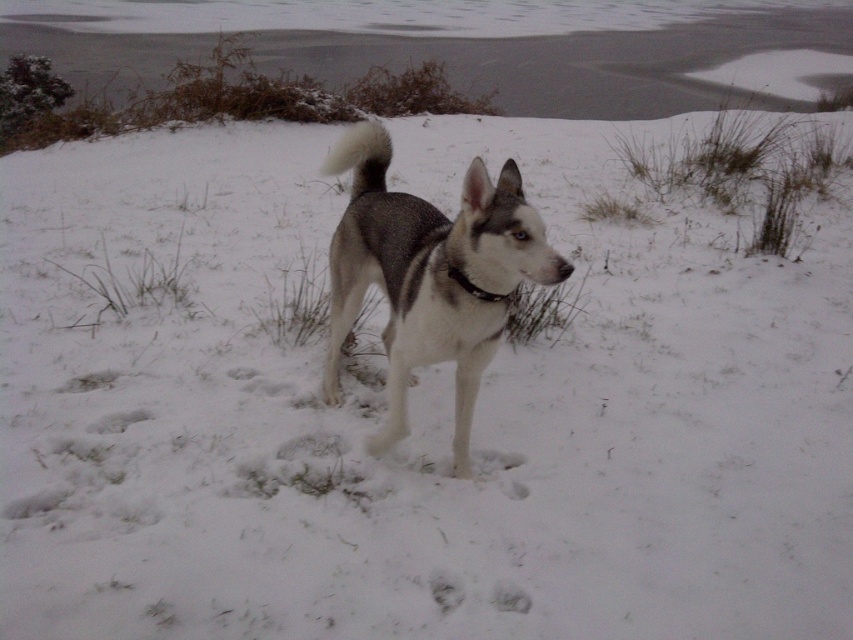
Question: Among these points, which one is farthest from the camera?

Choices:
 (A) (401, 227)
 (B) (471, 285)

Answer: (A)

Question: Does gray-white fur dog at center appear on the left side of black fabric neckband at center?

Choices:
 (A) no
 (B) yes

Answer: (B)

Question: Which of the following is the farthest from the observer?

Choices:
 (A) gray-white fur dog at center
 (B) black fabric neckband at center

Answer: (B)

Question: Is gray-white fur dog at center smaller than black fabric neckband at center?

Choices:
 (A) yes
 (B) no

Answer: (B)

Question: Where is gray-white fur dog at center located in relation to black fabric neckband at center in the image?

Choices:
 (A) right
 (B) left

Answer: (B)